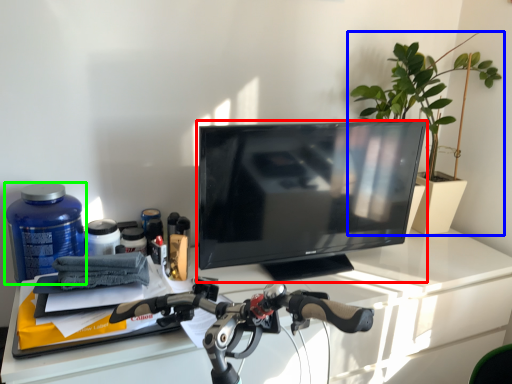
Question: Which object is positioned closest to television (highlighted by a red box)? Select from houseplant (highlighted by a blue box) and bottle (highlighted by a green box).

Choices:
 (A) houseplant
 (B) bottle

Answer: (A)